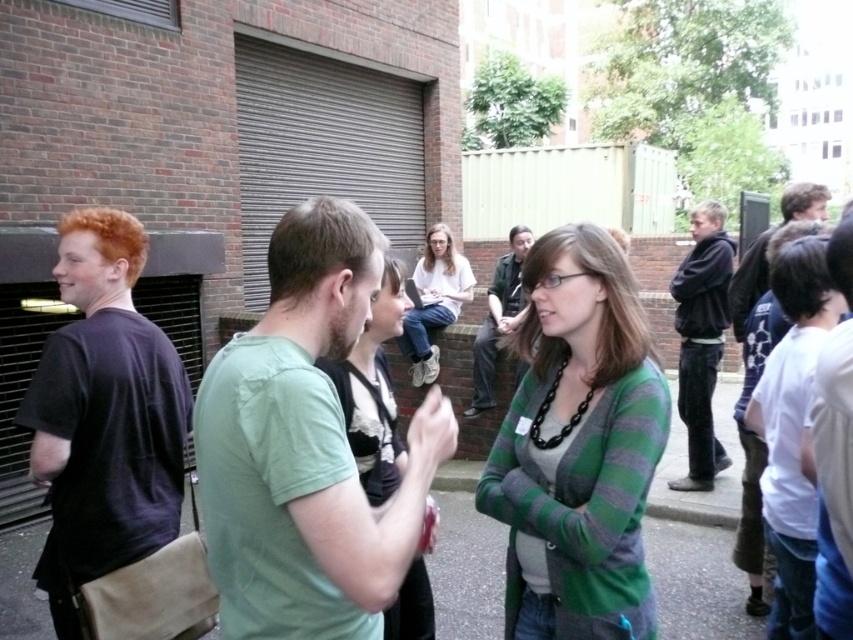
Question: Which object is farther from the camera taking this photo?

Choices:
 (A) white cotton shirt at right
 (B) dark brown t-shirt at left
 (C) dark green shirt at center
 (D) white shirt at center

Answer: (C)

Question: Is dark gray hoodie at right closer to camera compared to white matte shirt at center?

Choices:
 (A) yes
 (B) no

Answer: (B)

Question: Which object appears farthest from the camera in this image?

Choices:
 (A) matte green cardigan at center
 (B) green striped cardigan at center
 (C) green cotton shirt at center

Answer: (B)

Question: Among these points, which one is nearest to the camera?

Choices:
 (A) (242, 566)
 (B) (352, 422)
 (C) (485, 340)
 (D) (692, 420)

Answer: (A)

Question: Is matte green cardigan at center below dark green shirt at center?

Choices:
 (A) no
 (B) yes

Answer: (B)

Question: Does white shirt at center have a lesser width compared to white matte shirt at center?

Choices:
 (A) no
 (B) yes

Answer: (B)